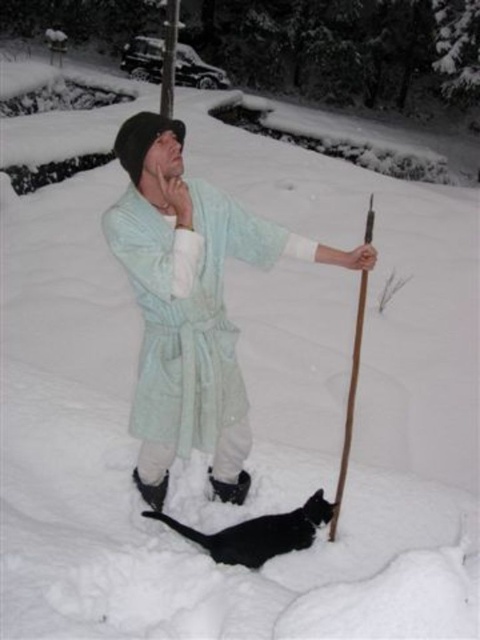
Question: Among these points, which one is nearest to the camera?

Choices:
 (A) (236, 524)
 (B) (348, 442)
 (C) (135, 275)

Answer: (C)

Question: Does light blue fabric robe at center appear under brown wood ski pole at center?

Choices:
 (A) no
 (B) yes

Answer: (B)

Question: Which point is farther to the camera?

Choices:
 (A) (343, 468)
 (B) (267, 556)
 (C) (133, 129)

Answer: (A)

Question: Does black fur cat at lower center have a lesser width compared to brown wood ski pole at center?

Choices:
 (A) no
 (B) yes

Answer: (B)

Question: Can you confirm if black fur cat at lower center is wider than brown wood ski pole at center?

Choices:
 (A) no
 (B) yes

Answer: (A)

Question: Which point is farther from the camera taking this photo?

Choices:
 (A) (343, 452)
 (B) (244, 486)
 (C) (249, 524)

Answer: (A)